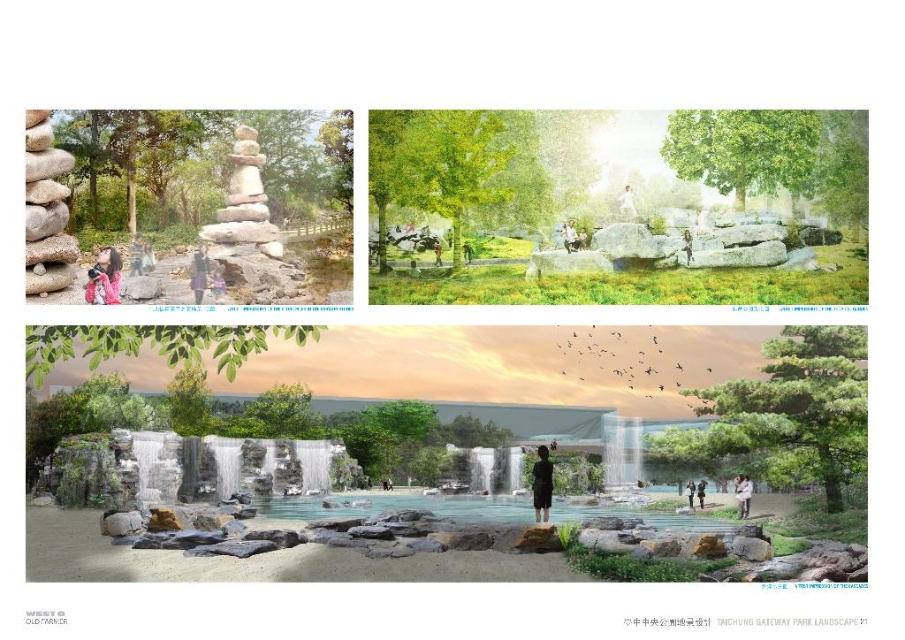
You are standing in the top left scene of the park design. You see two points marked on the ground at coordinates point (196, 292) and point (699, 493). Which point is closer to you?

Point (196, 292) is closer to the camera than point (699, 493), so the point closer to you is point (196, 292).

You are a visitor standing at the edge of the smooth gray stone waterfall at center and the dark gray fabric umbrella at center. Which object is taller?

The smooth gray stone waterfall at center is taller than the dark gray fabric umbrella at center according to the description.